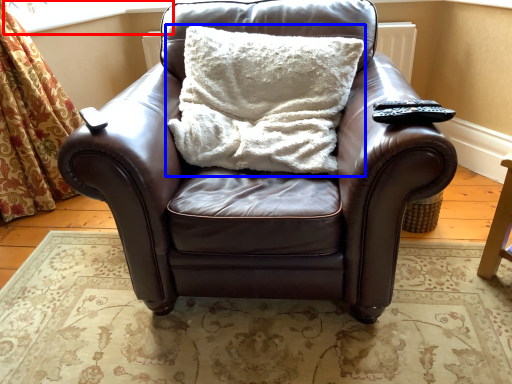
Question: Among these objects, which one is nearest to the camera, window screen (highlighted by a red box) or pillow (highlighted by a blue box)?

Choices:
 (A) window screen
 (B) pillow

Answer: (B)